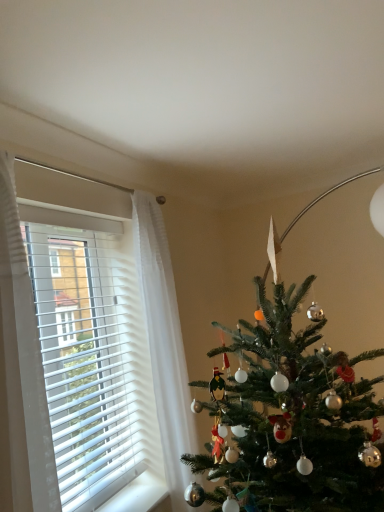
Where is `green matte christmas tree at center`? This screenshot has height=512, width=384. green matte christmas tree at center is located at coordinates (290, 419).

Does green matte christmas tree at right appear on the left side of green matte christmas tree at center?

Indeed, green matte christmas tree at right is positioned on the left side of green matte christmas tree at center.

From a real-world perspective, which is physically below, green matte christmas tree at right or green matte christmas tree at center?

In real-world perspective, green matte christmas tree at right is lower.

Locate an element on the screen. Image resolution: width=384 pixels, height=512 pixels. christmas tree on the right of green matte christmas tree at right is located at coordinates (290, 419).

Is green matte christmas tree at right spatially inside green matte christmas tree at center, or outside of it?

The correct answer is: outside.

In terms of height, does green matte christmas tree at center look taller or shorter compared to green matte christmas tree at right?

Considering their sizes, green matte christmas tree at center has less height than green matte christmas tree at right.

Is green matte christmas tree at center wider or thinner than green matte christmas tree at right?

Clearly, green matte christmas tree at center has more width compared to green matte christmas tree at right.

In terms of size, does green matte christmas tree at center appear bigger or smaller than green matte christmas tree at right?

green matte christmas tree at center is smaller than green matte christmas tree at right.

Is green matte christmas tree at center facing towards green matte christmas tree at right?

No.

Is green matte christmas tree at right directly adjacent to white blinds at left?

No, green matte christmas tree at right is not beside white blinds at left.

Would you say green matte christmas tree at right contains white blinds at left?

Actually, white blinds at left is outside green matte christmas tree at right.

Considering the sizes of green matte christmas tree at right and white blinds at left in the image, is green matte christmas tree at right bigger or smaller than white blinds at left?

Considering their sizes, green matte christmas tree at right takes up more space than white blinds at left.

Does green matte christmas tree at right have a lesser height compared to white blinds at left?

In fact, green matte christmas tree at right may be taller than white blinds at left.

From a real-world perspective, is white blinds at left physically located above or below green matte christmas tree at center?

white blinds at left is situated higher than green matte christmas tree at center in the real world.

Who is taller, white blinds at left or green matte christmas tree at center?

With more height is green matte christmas tree at center.

Which of these two, white blinds at left or green matte christmas tree at right, stands shorter?

white blinds at left is shorter.

Which object is further away from the camera taking this photo, white blinds at left or green matte christmas tree at right?

white blinds at left.

Is white blinds at left to the right of green matte christmas tree at right from the viewer's perspective?

In fact, white blinds at left is to the left of green matte christmas tree at right.

How distant is white blinds at left from green matte christmas tree at right?

They are 32.23 inches apart.

Is green matte christmas tree at center looking in the opposite direction of white blinds at left?

green matte christmas tree at center does not have its back to white blinds at left.

Is green matte christmas tree at center smaller than white blinds at left?

No.

Is green matte christmas tree at center spatially inside white blinds at left, or outside of it?

green matte christmas tree at center exists outside the volume of white blinds at left.

From a real-world perspective, is green matte christmas tree at center over white blinds at left?

No, from a real-world perspective, green matte christmas tree at center is not above white blinds at left.

Identify the location of christmas eve directly beneath the green matte christmas tree at center (from a real-world perspective). The height and width of the screenshot is (512, 384). (21, 373).

Locate an element on the screen. The width and height of the screenshot is (384, 512). christmas tree that appears on the right of green matte christmas tree at right is located at coordinates (290, 419).

Considering their positions, is white blinds at left positioned closer to green matte christmas tree at center than green matte christmas tree at right?

white blinds at left.

Looking at the image, which one is located further to white blinds at left, green matte christmas tree at center or green matte christmas tree at right?

Based on the image, green matte christmas tree at right appears to be further to white blinds at left.

Estimate the real-world distances between objects in this image. Which object is further from green matte christmas tree at right, green matte christmas tree at center or white blinds at left?

The object further to green matte christmas tree at right is white blinds at left.

When comparing their distances from green matte christmas tree at center, does green matte christmas tree at right or white blinds at left seem closer?

Among the two, white blinds at left is located nearer to green matte christmas tree at center.

In the scene shown: Based on their spatial positions, is white blinds at left or green matte christmas tree at center closer to green matte christmas tree at right?

green matte christmas tree at center lies closer to green matte christmas tree at right than the other object.

When comparing their distances from white blinds at left, does green matte christmas tree at right or green matte christmas tree at center seem closer?

green matte christmas tree at center.

Where is `christmas eve located between white blinds at left and green matte christmas tree at center in the left-right direction`? The width and height of the screenshot is (384, 512). christmas eve located between white blinds at left and green matte christmas tree at center in the left-right direction is located at coordinates pyautogui.click(x=21, y=373).